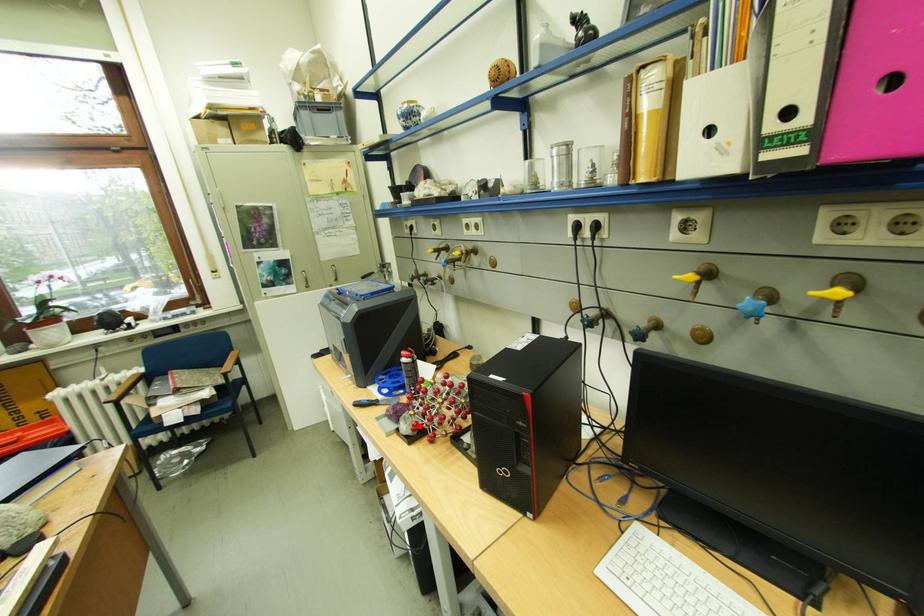
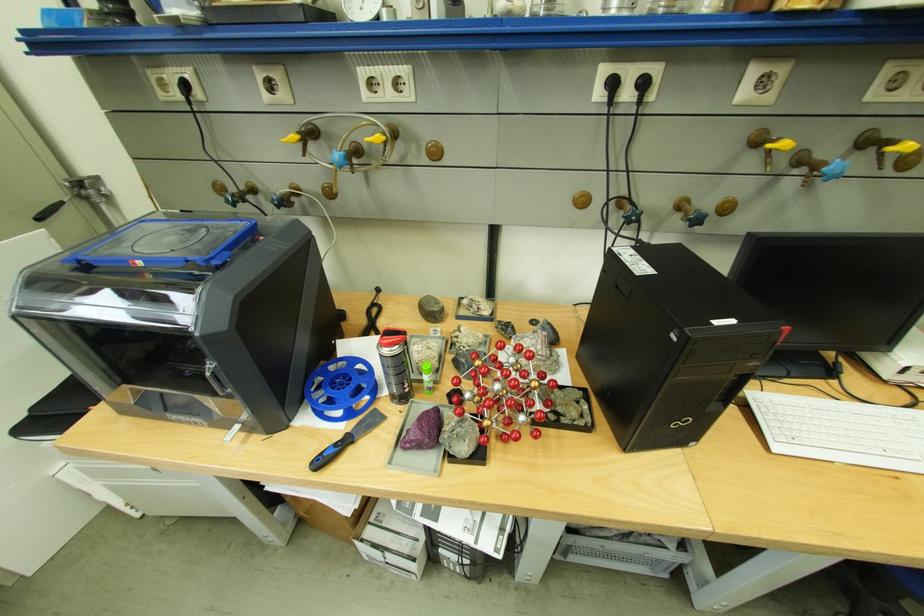
Question: I am providing you with two images of the same scene from different viewpoints. A red point is shown in image1. For the corresponding object point in image2, is it positioned nearer or farther from the camera?

Choices:
 (A) Nearer
 (B) Farther

Answer: (A)